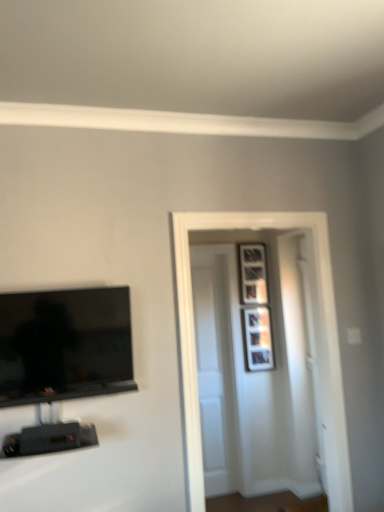
Question: Can you confirm if matte silver picture frame at upper right, which is counted as the second picture frame, starting from the top, is positioned to the left of white glossy door at center, arranged as the 2th door when viewed from the back?

Choices:
 (A) no
 (B) yes

Answer: (A)

Question: Is matte silver picture frame at upper right, marked as the first picture frame in a bottom-to-top arrangement, at the right side of white glossy door at center, arranged as the 2th door when viewed from the back?

Choices:
 (A) no
 (B) yes

Answer: (B)

Question: Is white glossy door at center, arranged as the 2th door when viewed from the back, at the back of matte silver picture frame at upper right, marked as the first picture frame in a bottom-to-top arrangement?

Choices:
 (A) yes
 (B) no

Answer: (B)

Question: From the image's perspective, is matte silver picture frame at upper right, marked as the first picture frame in a bottom-to-top arrangement, located beneath white glossy door at center, the first door viewed from the front?

Choices:
 (A) yes
 (B) no

Answer: (A)

Question: From the image's perspective, is matte silver picture frame at upper right, marked as the first picture frame in a bottom-to-top arrangement, on top of white glossy door at center, arranged as the 2th door when viewed from the back?

Choices:
 (A) no
 (B) yes

Answer: (A)

Question: Is point (223, 287) positioned closer to the camera than point (8, 380)?

Choices:
 (A) farther
 (B) closer

Answer: (A)

Question: Is white wooden door at center, positioned as the first door in back-to-front order, to the left or to the right of black glossy tv at left in the image?

Choices:
 (A) left
 (B) right

Answer: (B)

Question: From the image's perspective, is white wooden door at center, marked as the second door in a front-to-back arrangement, located above or below black glossy tv at left?

Choices:
 (A) above
 (B) below

Answer: (B)

Question: From a real-world perspective, is white wooden door at center, marked as the second door in a front-to-back arrangement, positioned above or below black glossy tv at left?

Choices:
 (A) above
 (B) below

Answer: (B)

Question: Looking at the image, does matte silver picture frame at upper right, which is counted as the second picture frame, starting from the top, seem bigger or smaller compared to white glossy door at center, the first door viewed from the front?

Choices:
 (A) big
 (B) small

Answer: (B)

Question: From a real-world perspective, is matte silver picture frame at upper right, which is counted as the second picture frame, starting from the top, physically located above or below white glossy door at center, arranged as the 2th door when viewed from the back?

Choices:
 (A) below
 (B) above

Answer: (B)

Question: Considering the positions of matte silver picture frame at upper right, marked as the first picture frame in a bottom-to-top arrangement, and white glossy door at center, the first door viewed from the front, in the image, is matte silver picture frame at upper right, marked as the first picture frame in a bottom-to-top arrangement, wider or thinner than white glossy door at center, the first door viewed from the front,?

Choices:
 (A) wide
 (B) thin

Answer: (B)

Question: Considering the positions of point (256, 367) and point (266, 211), is point (256, 367) closer or farther from the camera than point (266, 211)?

Choices:
 (A) closer
 (B) farther

Answer: (B)

Question: Does point click(x=329, y=288) appear closer or farther from the camera than point click(x=203, y=320)?

Choices:
 (A) farther
 (B) closer

Answer: (B)

Question: Is white glossy door at center, arranged as the 2th door when viewed from the back, in front of or behind white wooden door at center, positioned as the first door in back-to-front order, in the image?

Choices:
 (A) front
 (B) behind

Answer: (A)